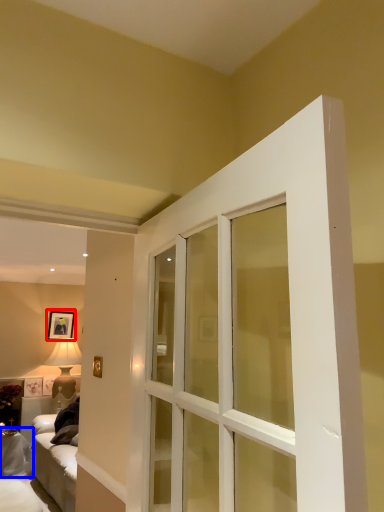
Question: Which of the following is the closest to the observer, picture frame (highlighted by a red box) or furniture (highlighted by a blue box)?

Choices:
 (A) picture frame
 (B) furniture

Answer: (B)